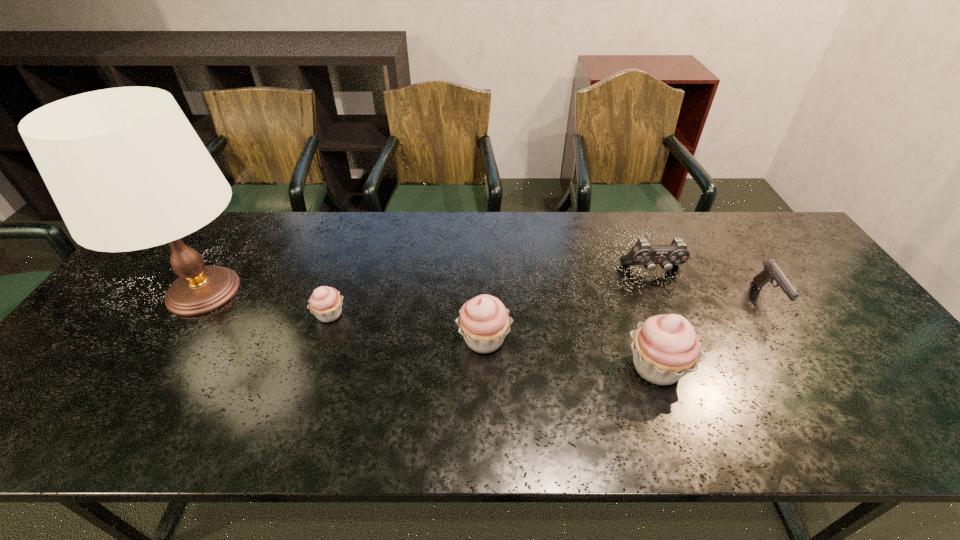
Find the location of a particular element. The height and width of the screenshot is (540, 960). vacant space at the near edge of the desktop is located at coordinates (766, 389).

Locate an element on the screen. vacant space at the left edge of the desktop is located at coordinates (107, 326).

Image resolution: width=960 pixels, height=540 pixels. What are the coordinates of `vacant space at the right edge of the desktop` in the screenshot? It's located at (805, 302).

At what (x,y) coordinates should I click in order to perform the action: click on vacant space at the far left corner of the desktop. Please return your answer as a coordinate pair (x, y). Image resolution: width=960 pixels, height=540 pixels. Looking at the image, I should click on (220, 217).

The image size is (960, 540). In the image, there is a desktop. What are the coordinates of `vacant area at the near left corner` in the screenshot? It's located at (99, 402).

The height and width of the screenshot is (540, 960). In order to click on unoccupied area between the control and the rightmost object in this screenshot , I will do `click(709, 285)`.

Find the location of a particular element. vacant area that lies between the control and the tallest object is located at coordinates (428, 281).

At what (x,y) coordinates should I click in order to perform the action: click on free spot between the lamp and the control. Please return your answer as a coordinate pair (x, y). This screenshot has height=540, width=960. Looking at the image, I should click on (428, 281).

Image resolution: width=960 pixels, height=540 pixels. What are the coordinates of `free point between the tallest object and the rightmost cupcake` in the screenshot? It's located at (431, 329).

Where is `vacant area that lies between the tallest object and the second shortest cupcake`? vacant area that lies between the tallest object and the second shortest cupcake is located at coordinates (345, 315).